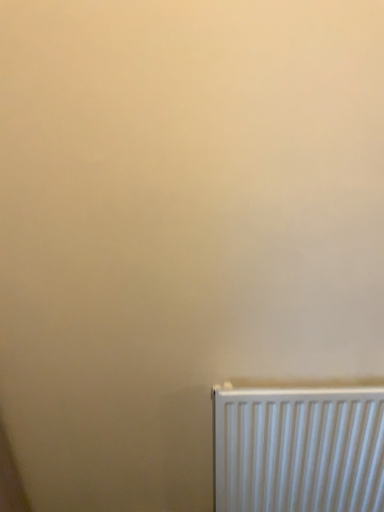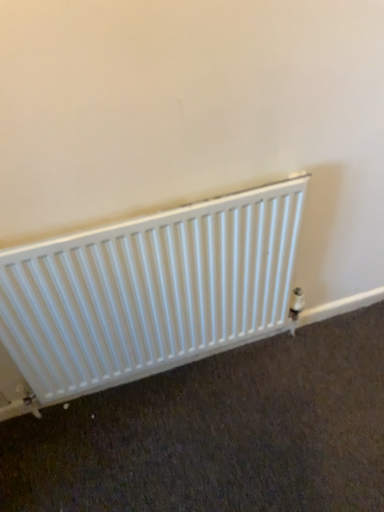
Question: Which way did the camera rotate in the video?

Choices:
 (A) rotated upward
 (B) rotated downward

Answer: (B)